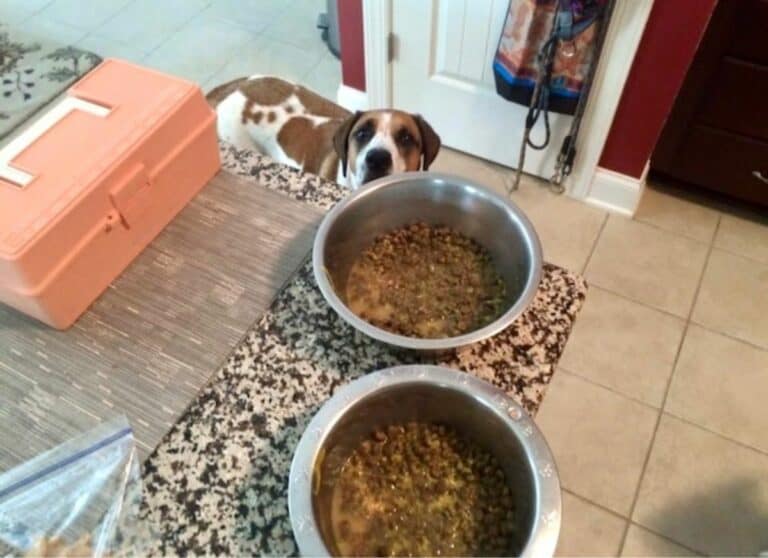
Where is `light brown and gray cutting board`? light brown and gray cutting board is located at coordinates (156, 358).